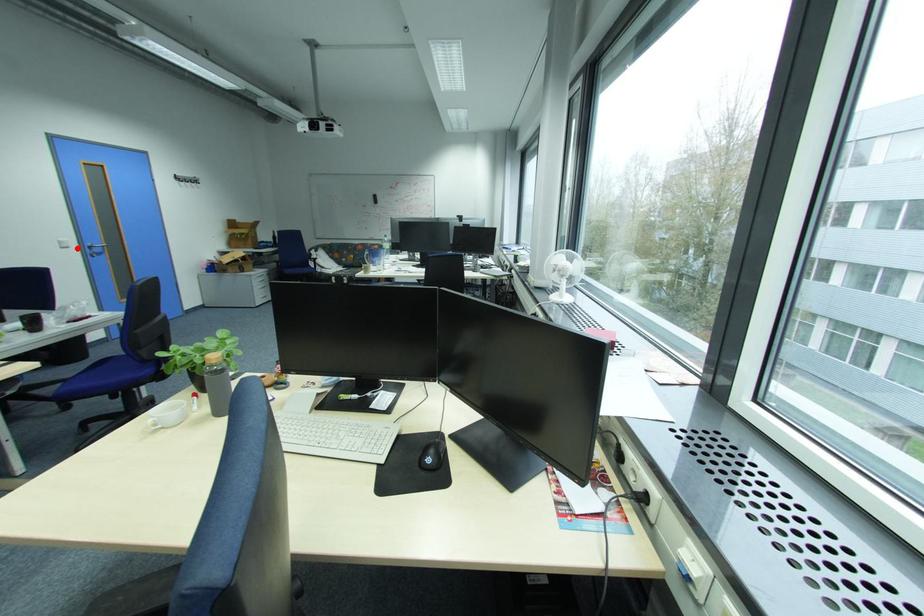
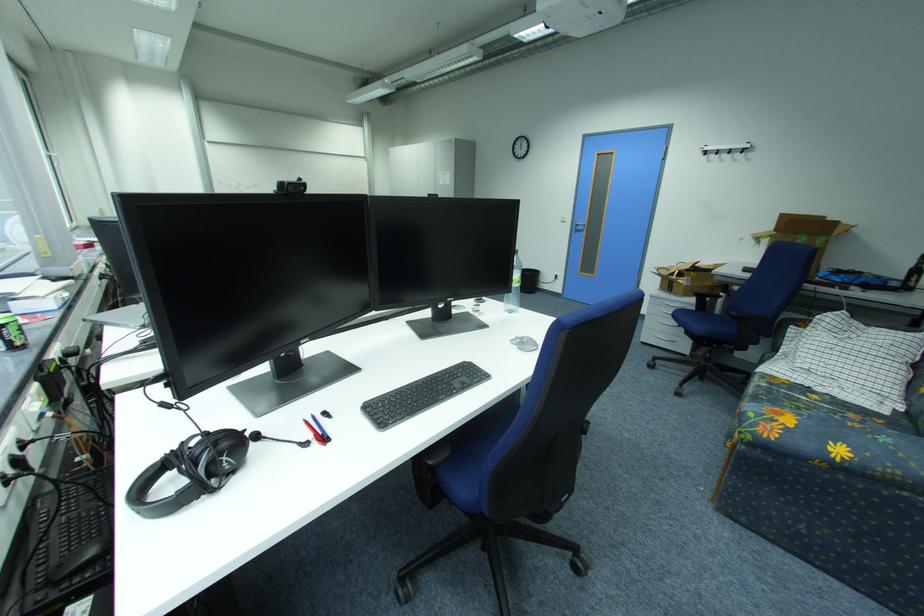
Where in the second image is the point corresponding to the highlighted location from the first image?

(574, 223)